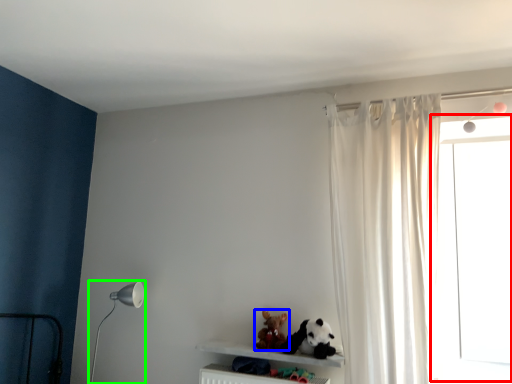
Question: Which is farther away from window frame (highlighted by a red box)? toy (highlighted by a blue box) or table lamp (highlighted by a green box)?

Choices:
 (A) toy
 (B) table lamp

Answer: (B)